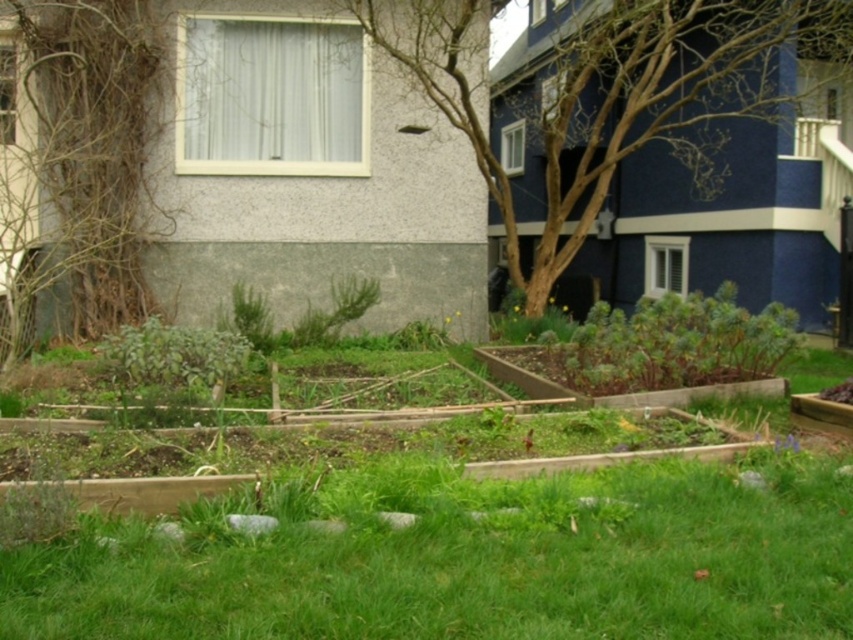
Does brown textured tree at center come in front of green wooden flower bed at center?

No, brown textured tree at center is behind green wooden flower bed at center.

Is brown textured tree at center bigger than green wooden flower bed at center?

Yes, brown textured tree at center is bigger than green wooden flower bed at center.

You are a GUI agent. You are given a task and a screenshot of the screen. Output one action in this format:
    pyautogui.click(x=<x>, y=<y>)
    Task: Click on the brown textured tree at center
    The image size is (853, 640).
    Given the screenshot: What is the action you would take?
    pyautogui.click(x=604, y=93)

Who is more distant from viewer, (265, 552) or (572, 77)?

Point (572, 77)

Between green grass at lower center and brown textured tree at center, which one appears on the left side from the viewer's perspective?

green grass at lower center is more to the left.

The image size is (853, 640). What do you see at coordinates (480, 566) in the screenshot?
I see `green grass at lower center` at bounding box center [480, 566].

Image resolution: width=853 pixels, height=640 pixels. I want to click on green grass at lower center, so click(x=480, y=566).

Is green grass at lower center smaller than brown textured tree at left?

Correct, green grass at lower center occupies less space than brown textured tree at left.

Who is more distant from viewer, (210, 630) or (39, 35)?

Positioned behind is point (39, 35).

Identify the location of green grass at lower center. (480, 566).

The image size is (853, 640). I want to click on green grass at lower center, so click(480, 566).